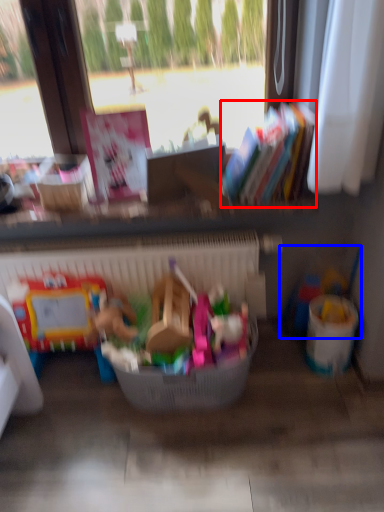
Question: Which object appears farthest to the camera in this image, book (highlighted by a red box) or toy (highlighted by a blue box)?

Choices:
 (A) book
 (B) toy

Answer: (B)